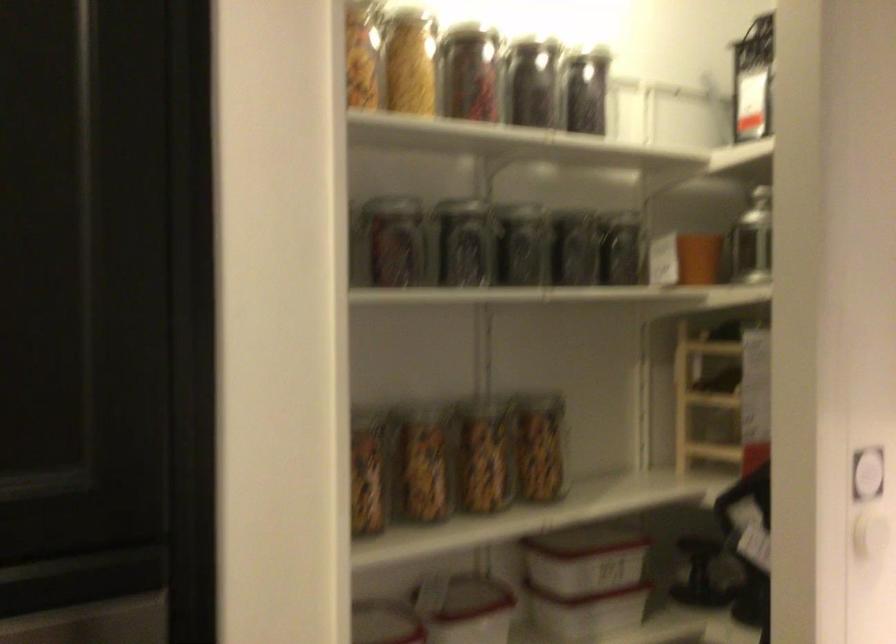
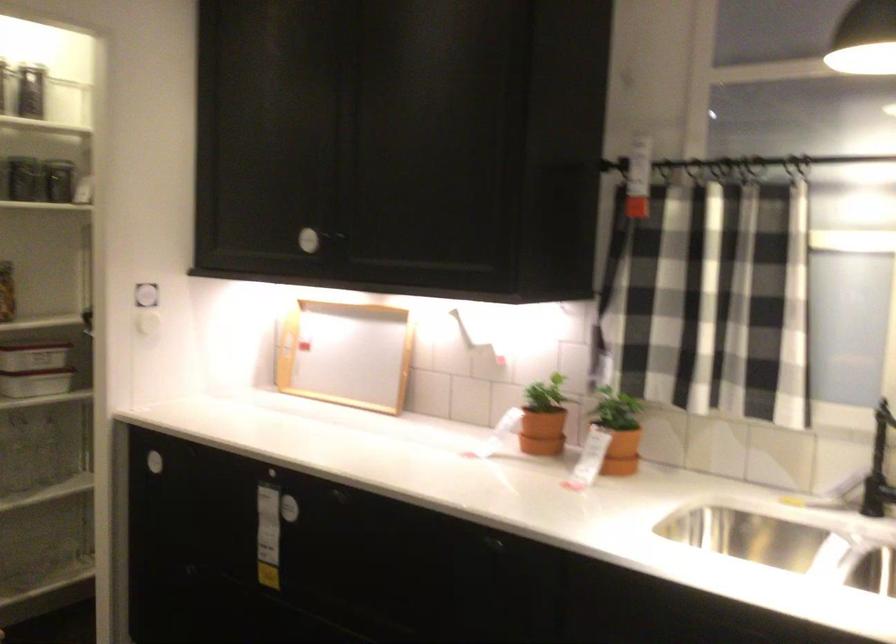
Question: I am providing you with two images of the same scene from different viewpoints. After the viewpoint changes to image2, which objects are now occluded?

Choices:
 (A) small terracotta pot
 (B) white electrical outlet
 (C) glass storage jar
 (D) black faucet handle

Answer: (A)